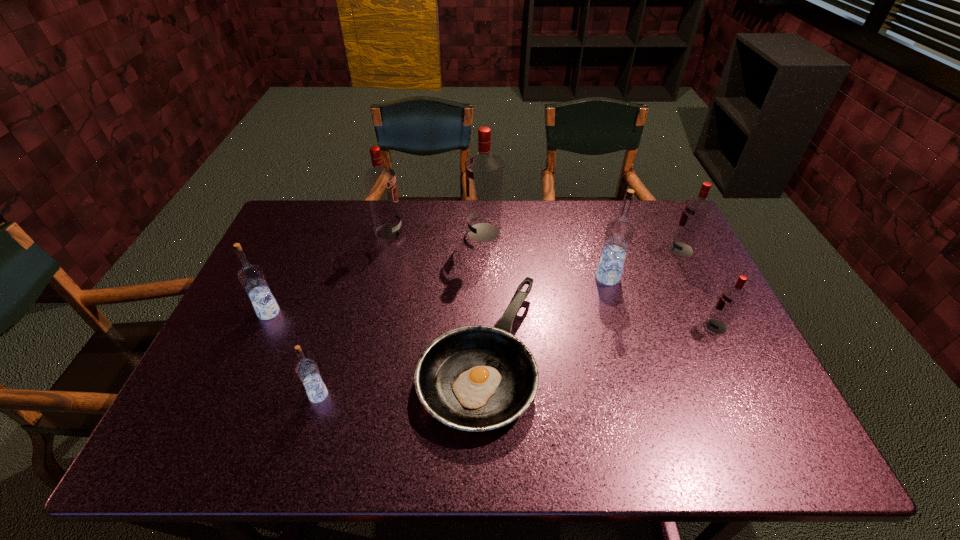
Find the location of a particular element. Image resolution: width=960 pixels, height=540 pixels. vacant region between the nearest red vodka and the red frying pan is located at coordinates (598, 341).

What are the coordinates of `vacant area that lies between the third object from left to right and the leftmost object` in the screenshot? It's located at (329, 272).

You are a GUI agent. You are given a task and a screenshot of the screen. Output one action in this format:
    pyautogui.click(x=<x>, y=<y>)
    Task: Click on the empty space that is in between the shortest object and the smallest red vodka
    
    Given the screenshot: What is the action you would take?
    pyautogui.click(x=598, y=341)

Locate an element on the screen. The height and width of the screenshot is (540, 960). free space between the third object from right to left and the second smallest red vodka is located at coordinates (644, 264).

You are a GUI agent. You are given a task and a screenshot of the screen. Output one action in this format:
    pyautogui.click(x=<x>, y=<y>)
    Task: Click on the free spot between the fourth farthest vodka and the third object from left to right
    Image resolution: width=960 pixels, height=540 pixels.
    Given the screenshot: What is the action you would take?
    pyautogui.click(x=498, y=254)

The height and width of the screenshot is (540, 960). What are the coordinates of `vacant point located between the sixth object from right to left and the leftmost blue vodka` in the screenshot? It's located at (329, 272).

At what (x,y) coordinates should I click in order to perform the action: click on vacant area that lies between the nearest red vodka and the leftmost object. Please return your answer as a coordinate pair (x, y). Looking at the image, I should click on (492, 320).

Where is `free point between the shortest object and the tallest object`? free point between the shortest object and the tallest object is located at coordinates (482, 294).

Choose which object is the third nearest neighbor to the second smallest red vodka. Please provide its 2D coordinates. Your answer should be formatted as a tuple, i.e. [(x, y)], where the tuple contains the x and y coordinates of a point satisfying the conditions above.

[(475, 378)]

Identify which object is the fourth closest to the fourth vodka from left to right. Please provide its 2D coordinates. Your answer should be formatted as a tuple, i.e. [(x, y)], where the tuple contains the x and y coordinates of a point satisfying the conditions above.

[(696, 211)]